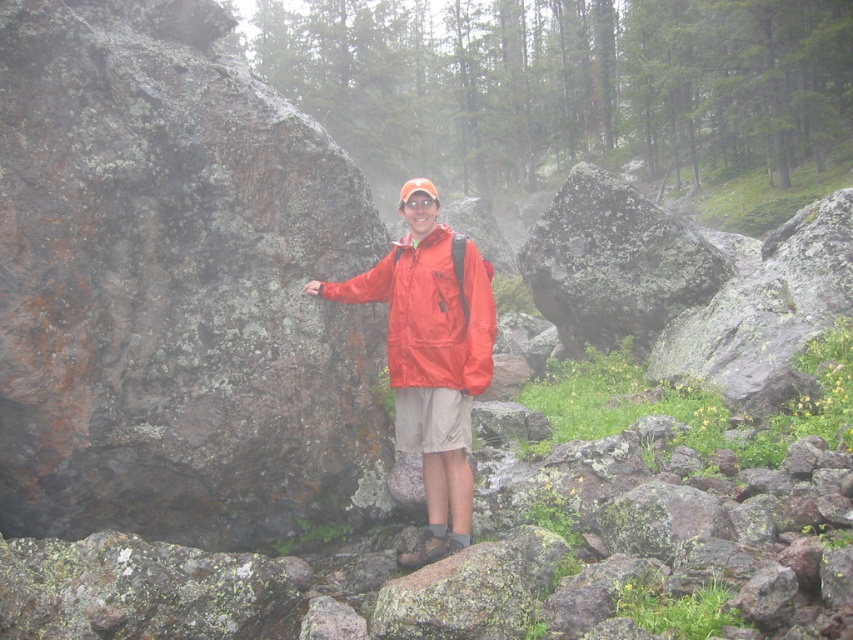
You are a hiker who just arrived at the scene. You see a point marked at coordinates (175, 289). What is the nearest object to that point?

The nearest object to the point at coordinates (175, 289) is the rusty rock at left, as the point is located on it.

You are a hiker who wants to place a GPS marker at the coordinates given in the description. Where should you place the GPS marker relative to the rusty rock at left?

The GPS marker should be placed at the coordinates corresponding to the rusty rock at left, which is located at point (x=175, y=289).

You are a hiker who needs to climb over a rock. You see the rusty rock at left and the green mossy rock at center. Which rock is taller and would require more effort to climb?

The rusty rock at left is taller than the green mossy rock at center, so it would require more effort to climb.